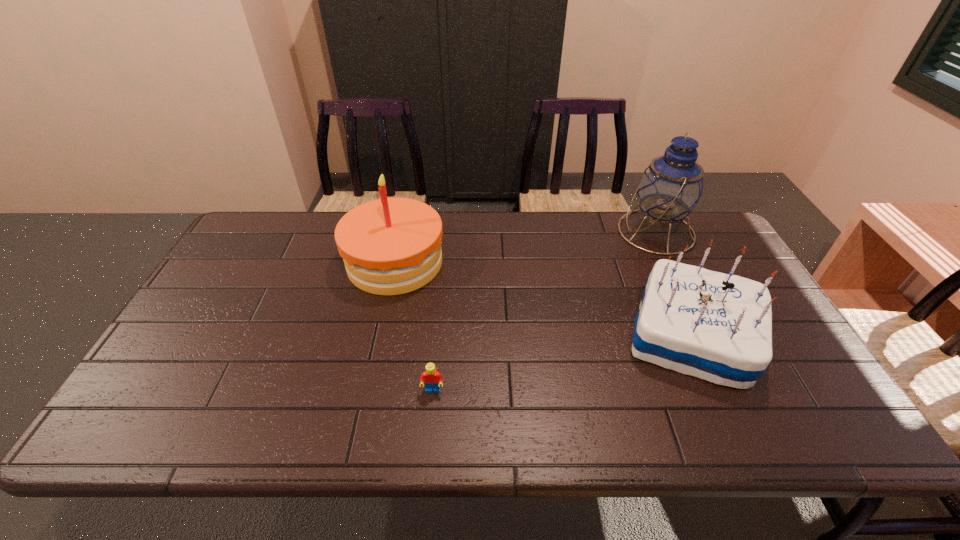
Locate an element on the screen. This screenshot has width=960, height=540. vacant point located between the lantern and the left birthday cake is located at coordinates (525, 247).

This screenshot has width=960, height=540. In order to click on free space between the lantern and the shortest object in this screenshot , I will do `click(544, 311)`.

Where is `vacant area that lies between the lantern and the left birthday cake`? This screenshot has height=540, width=960. vacant area that lies between the lantern and the left birthday cake is located at coordinates (525, 247).

In order to click on free space between the lantern and the left birthday cake in this screenshot , I will do `click(525, 247)`.

Where is `free point between the shortest object and the left birthday cake`? This screenshot has height=540, width=960. free point between the shortest object and the left birthday cake is located at coordinates (414, 327).

This screenshot has width=960, height=540. Find the location of `free point between the Lego and the taller birthday cake`. free point between the Lego and the taller birthday cake is located at coordinates click(414, 327).

Find the location of a particular element. Image resolution: width=960 pixels, height=540 pixels. empty space that is in between the taller birthday cake and the lantern is located at coordinates (525, 247).

Choose which object is the nearest neighbor to the shortest object. Please provide its 2D coordinates. Your answer should be formatted as a tuple, i.e. [(x, y)], where the tuple contains the x and y coordinates of a point satisfying the conditions above.

[(390, 246)]

This screenshot has height=540, width=960. I want to click on the third closest object relative to the right birthday cake, so click(390, 246).

In order to click on free space that satisfies the following two spatial constraints: 1. on the front side of the third tallest object; 2. on the right side of the taller birthday cake in this screenshot , I will do `click(379, 336)`.